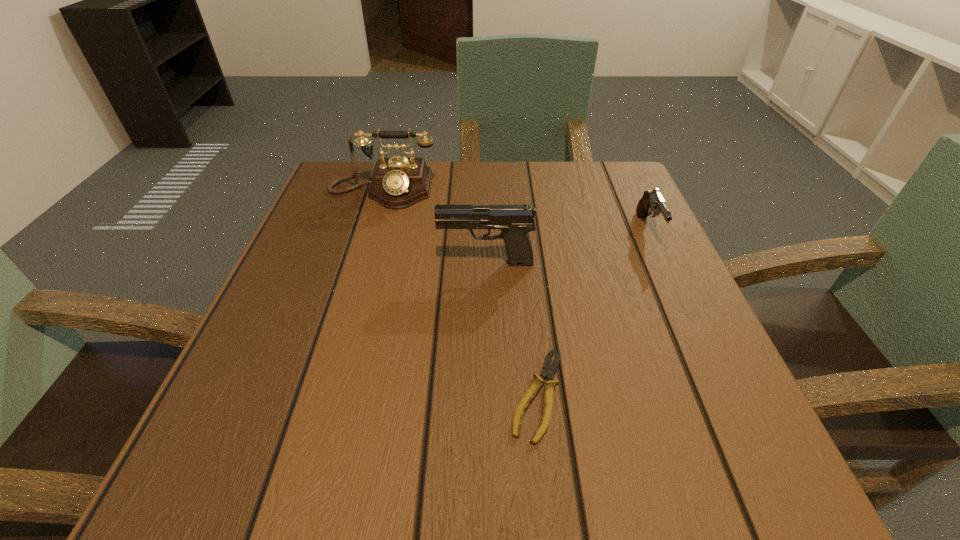
This screenshot has height=540, width=960. Find the location of `free space that satisfies the following two spatial constraints: 1. aim along the barrel of the taller pistol; 2. on the right side of the shortest object`. free space that satisfies the following two spatial constraints: 1. aim along the barrel of the taller pistol; 2. on the right side of the shortest object is located at coordinates (488, 394).

The image size is (960, 540). I want to click on blank area in the image that satisfies the following two spatial constraints: 1. at the barrel of the third nearest object; 2. aim along the barrel of the taller pistol, so click(663, 263).

Locate an element on the screen. The width and height of the screenshot is (960, 540). vacant space that satisfies the following two spatial constraints: 1. aim along the barrel of the nearer pistol; 2. on the right side of the shortest object is located at coordinates (488, 394).

At what (x,y) coordinates should I click in order to perform the action: click on free space that satisfies the following two spatial constraints: 1. on the dial of the farthest object; 2. on the left side of the nearest object. Please return your answer as a coordinate pair (x, y). This screenshot has height=540, width=960. Looking at the image, I should click on (322, 394).